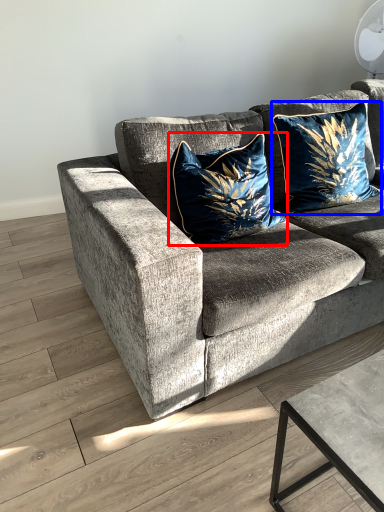
Question: Which object appears closest to the camera in this image, pillow (highlighted by a red box) or pillow (highlighted by a blue box)?

Choices:
 (A) pillow
 (B) pillow

Answer: (A)